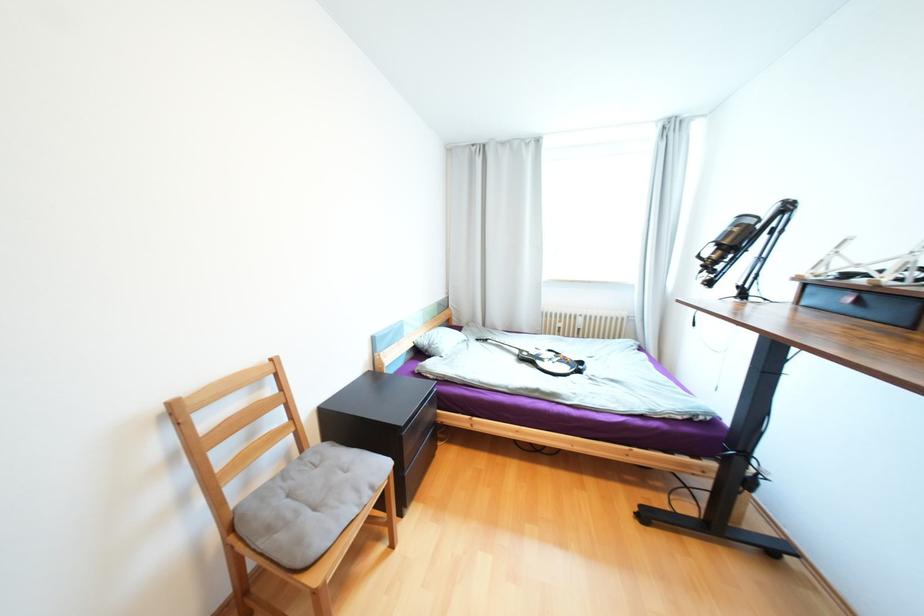
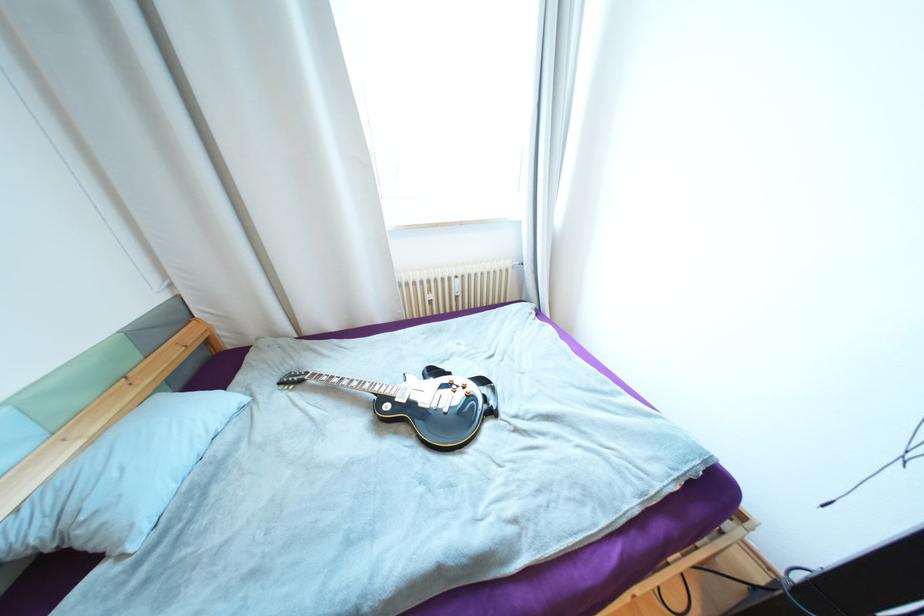
The point at (585, 371) is marked in the first image. Where is the corresponding point in the second image?

(497, 413)